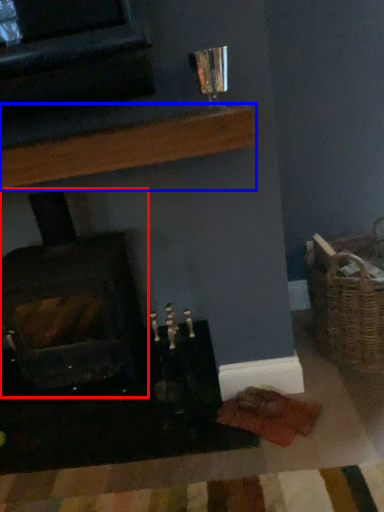
Question: Which object appears closest to the camera in this image, wood burning stove (highlighted by a red box) or shelf (highlighted by a blue box)?

Choices:
 (A) wood burning stove
 (B) shelf

Answer: (B)